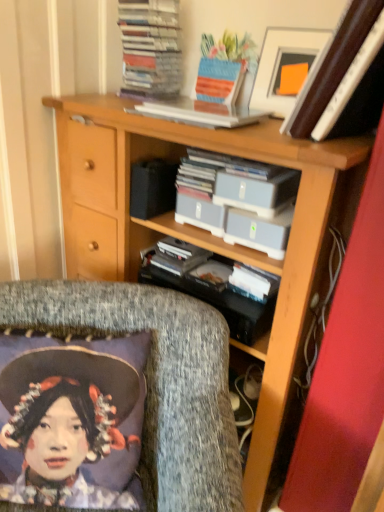
Question: Is textured gray cushion at lower left in front of wooden bookcase at center?

Choices:
 (A) no
 (B) yes

Answer: (B)

Question: Considering the relative positions of textured gray cushion at lower left and wooden bookcase at center in the image provided, is textured gray cushion at lower left to the right of wooden bookcase at center from the viewer's perspective?

Choices:
 (A) yes
 (B) no

Answer: (B)

Question: From the image's perspective, does textured gray cushion at lower left appear higher than wooden bookcase at center?

Choices:
 (A) yes
 (B) no

Answer: (B)

Question: Is textured gray cushion at lower left taller than wooden bookcase at center?

Choices:
 (A) yes
 (B) no

Answer: (B)

Question: Can you confirm if textured gray cushion at lower left is smaller than wooden bookcase at center?

Choices:
 (A) no
 (B) yes

Answer: (B)

Question: Is point (304, 72) positioned closer to the camera than point (198, 234)?

Choices:
 (A) farther
 (B) closer

Answer: (B)

Question: Is white glossy picture frame at upper right spatially inside matte plastic storage boxes at center, or outside of it?

Choices:
 (A) inside
 (B) outside

Answer: (B)

Question: From a real-world perspective, is white glossy picture frame at upper right physically located above or below matte plastic storage boxes at center?

Choices:
 (A) above
 (B) below

Answer: (A)

Question: Based on their positions, is white glossy picture frame at upper right located to the left or right of matte plastic storage boxes at center?

Choices:
 (A) right
 (B) left

Answer: (A)

Question: Is white glossy picture frame at upper right bigger or smaller than gray plastic case at center?

Choices:
 (A) big
 (B) small

Answer: (A)

Question: In the image, is white glossy picture frame at upper right on the left side or the right side of gray plastic case at center?

Choices:
 (A) left
 (B) right

Answer: (B)

Question: Considering the positions of white glossy picture frame at upper right and gray plastic case at center in the image, is white glossy picture frame at upper right taller or shorter than gray plastic case at center?

Choices:
 (A) short
 (B) tall

Answer: (B)

Question: From the image's perspective, is white glossy picture frame at upper right above or below gray plastic case at center?

Choices:
 (A) below
 (B) above

Answer: (B)

Question: Considering their positions, is wooden bookcase at center located in front of or behind textured gray cushion at lower left?

Choices:
 (A) behind
 (B) front

Answer: (A)

Question: From the image's perspective, is wooden bookcase at center positioned above or below textured gray cushion at lower left?

Choices:
 (A) below
 (B) above

Answer: (B)